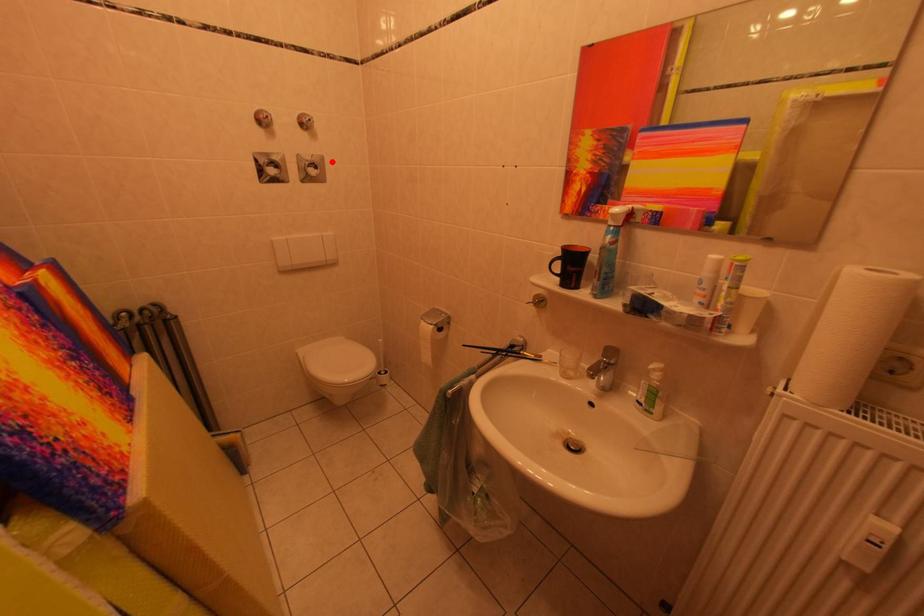
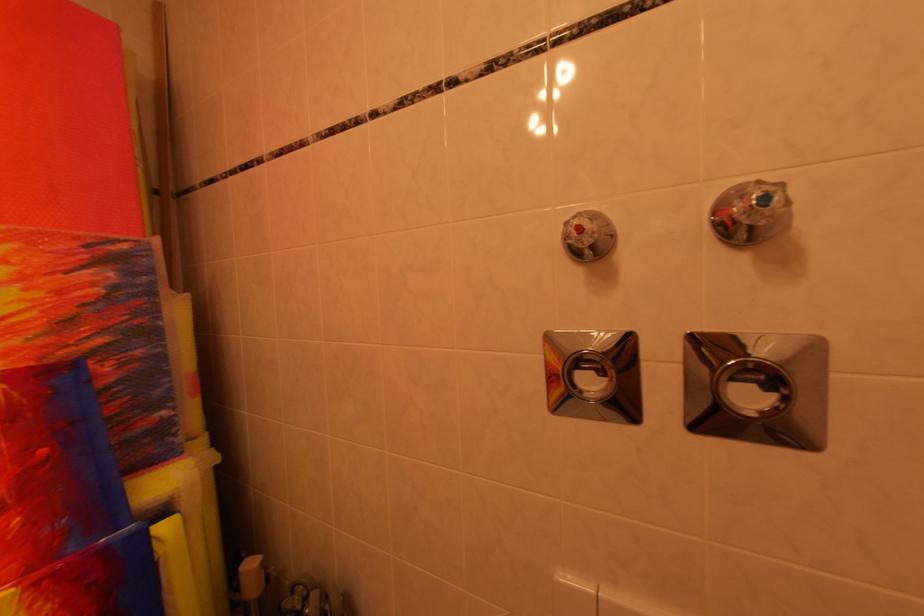
Where in the second image is the point corresponding to the highlighted location from the first image?

(824, 351)